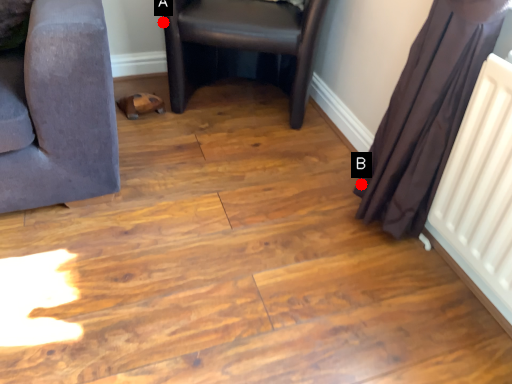
Question: Two points are circled on the image, labeled by A and B beside each circle. Which point is further to the camera?

Choices:
 (A) A is further
 (B) B is further

Answer: (A)